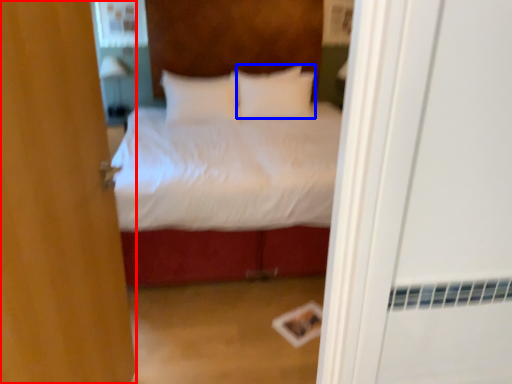
Question: Which of the following is the closest to the observer, door (highlighted by a red box) or pillow (highlighted by a blue box)?

Choices:
 (A) door
 (B) pillow

Answer: (A)